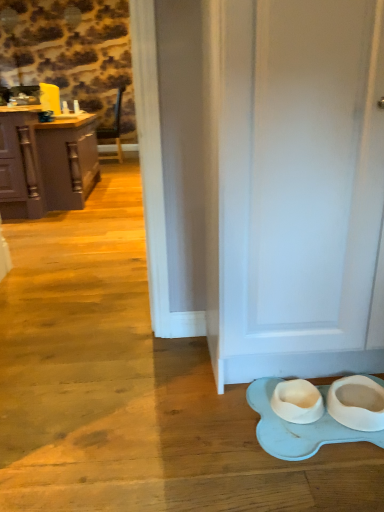
The height and width of the screenshot is (512, 384). What are the coordinates of `matte gray cabinets at left` in the screenshot? It's located at (45, 163).

This screenshot has width=384, height=512. Describe the element at coordinates (45, 163) in the screenshot. I see `matte gray cabinets at left` at that location.

You are a GUI agent. You are given a task and a screenshot of the screen. Output one action in this format:
    pyautogui.click(x=<x>, y=<y>)
    Task: Click on the white matte door at lower right
    
    Given the screenshot: What is the action you would take?
    pyautogui.click(x=295, y=187)

This screenshot has width=384, height=512. Describe the element at coordinates (295, 187) in the screenshot. I see `white matte door at lower right` at that location.

In order to click on matte gray cabinets at left in this screenshot , I will do `click(45, 163)`.

Which is more to the left, matte gray cabinets at left or white matte door at lower right?

matte gray cabinets at left.

Considering the relative positions of matte gray cabinets at left and white matte door at lower right in the image provided, is matte gray cabinets at left behind white matte door at lower right?

Yes.

Does point (46, 141) come farther from viewer compared to point (358, 197)?

That is True.

From the image's perspective, relative to white matte door at lower right, is matte gray cabinets at left above or below?

matte gray cabinets at left is above white matte door at lower right.

From a real-world perspective, is matte gray cabinets at left beneath white matte door at lower right?

Yes, from a real-world perspective, matte gray cabinets at left is below white matte door at lower right.

Considering the sizes of matte gray cabinets at left and white matte door at lower right in the image, is matte gray cabinets at left wider or thinner than white matte door at lower right?

matte gray cabinets at left is wider than white matte door at lower right.

Considering the sizes of matte gray cabinets at left and white matte door at lower right in the image, is matte gray cabinets at left taller or shorter than white matte door at lower right?

In the image, matte gray cabinets at left appears to be shorter than white matte door at lower right.

Can you confirm if matte gray cabinets at left is bigger than white matte door at lower right?

Yes, matte gray cabinets at left is bigger than white matte door at lower right.

Can we say matte gray cabinets at left lies outside white matte door at lower right?

Yes, matte gray cabinets at left is outside of white matte door at lower right.

Is the surface of matte gray cabinets at left in direct contact with white matte door at lower right?

No, matte gray cabinets at left is not beside white matte door at lower right.

Does matte gray cabinets at left turn towards white matte door at lower right?

No, matte gray cabinets at left is not aimed at white matte door at lower right.

What's the angular difference between matte gray cabinets at left and white matte door at lower right's facing directions?

87.3 degrees separate the facing orientations of matte gray cabinets at left and white matte door at lower right.

Measure the distance between matte gray cabinets at left and white matte door at lower right.

matte gray cabinets at left and white matte door at lower right are 9.42 feet apart from each other.

Where is `door below the matte gray cabinets at left (from the image's perspective)`? The height and width of the screenshot is (512, 384). door below the matte gray cabinets at left (from the image's perspective) is located at coordinates (295, 187).

In the image, is white matte door at lower right on the left side or the right side of matte gray cabinets at left?

Clearly, white matte door at lower right is on the right of matte gray cabinets at left in the image.

Which object is closer to the camera, white matte door at lower right or matte gray cabinets at left?

white matte door at lower right.

Which is further, (264, 28) or (61, 168)?

The point (61, 168) is farther from the camera.

From the image's perspective, is white matte door at lower right below matte gray cabinets at left?

Correct, white matte door at lower right appears lower than matte gray cabinets at left in the image.

From a real-world perspective, is white matte door at lower right under matte gray cabinets at left?

No, from a real-world perspective, white matte door at lower right is not beneath matte gray cabinets at left.

Looking at this image, which object is thinner, white matte door at lower right or matte gray cabinets at left?

white matte door at lower right is thinner.

Is white matte door at lower right taller or shorter than matte gray cabinets at left?

In the image, white matte door at lower right appears to be taller than matte gray cabinets at left.

Between white matte door at lower right and matte gray cabinets at left, which one has larger size?

matte gray cabinets at left.

Would you say white matte door at lower right is inside or outside matte gray cabinets at left?

white matte door at lower right is not enclosed by matte gray cabinets at left.

Is white matte door at lower right directly adjacent to matte gray cabinets at left?

They are not placed beside each other.

Is white matte door at lower right aimed at matte gray cabinets at left?

No.

Find the location of a particular element. Image resolution: width=384 pixels, height=512 pixels. cabinetry beneath the white matte door at lower right (from a real-world perspective) is located at coordinates (45, 163).

The width and height of the screenshot is (384, 512). I want to click on door that appears on the right of matte gray cabinets at left, so click(295, 187).

At what (x,y) coordinates should I click in order to perform the action: click on door in front of the matte gray cabinets at left. Please return your answer as a coordinate pair (x, y). The height and width of the screenshot is (512, 384). Looking at the image, I should click on (295, 187).